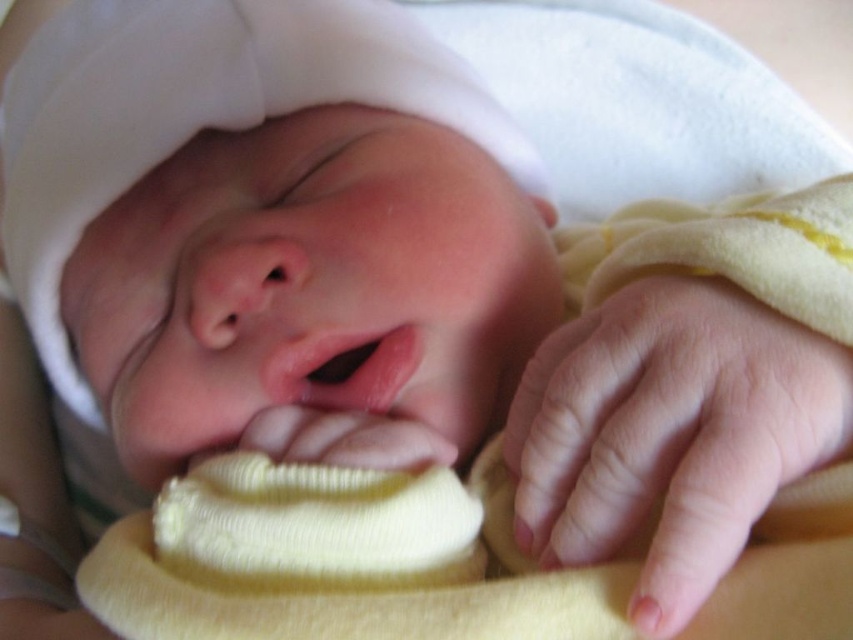
You are a photographer taking a close up of a newborn baby. You have two points marked on the image, point 1 at coordinates point (712, 570) and point 2 at coordinates point (367, 360). If you want to focus on the point that is closer to your camera, which point should you choose?

Point (712, 570) is closer to the camera than point (367, 360), so you should choose point (712, 570) to focus on.

Looking at the newborn baby in the image, which object is positioned to the right of the other between the pink smooth skin at center and the smooth pink lips at center?

The pink smooth skin at center is to the right of the smooth pink lips at center.

Looking at the newborn baby in the pale yellow blanket, which object is larger in height between the pink smooth skin at center and the smooth pink lips at center?

The pink smooth skin at center is much taller than the smooth pink lips at center.